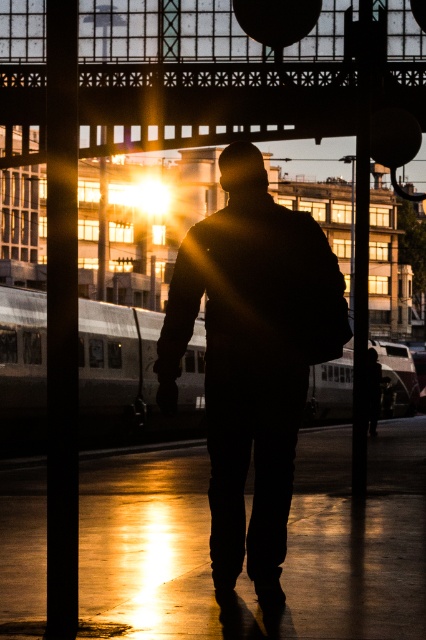
Who is positioned more to the left, black matte jacket at center or silver metallic train at center?

black matte jacket at center

The width and height of the screenshot is (426, 640). I want to click on black matte jacket at center, so click(x=249, y=356).